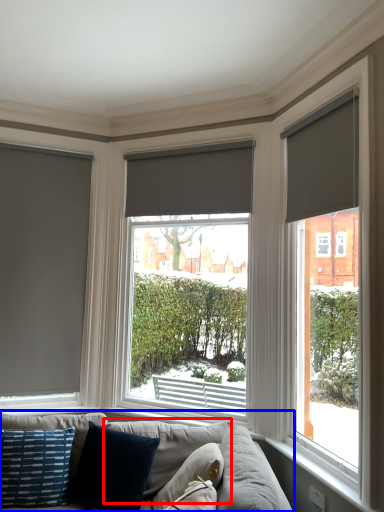
Question: Among these objects, which one is nearest to the camera, pillow (highlighted by a red box) or studio couch (highlighted by a blue box)?

Choices:
 (A) pillow
 (B) studio couch

Answer: (A)